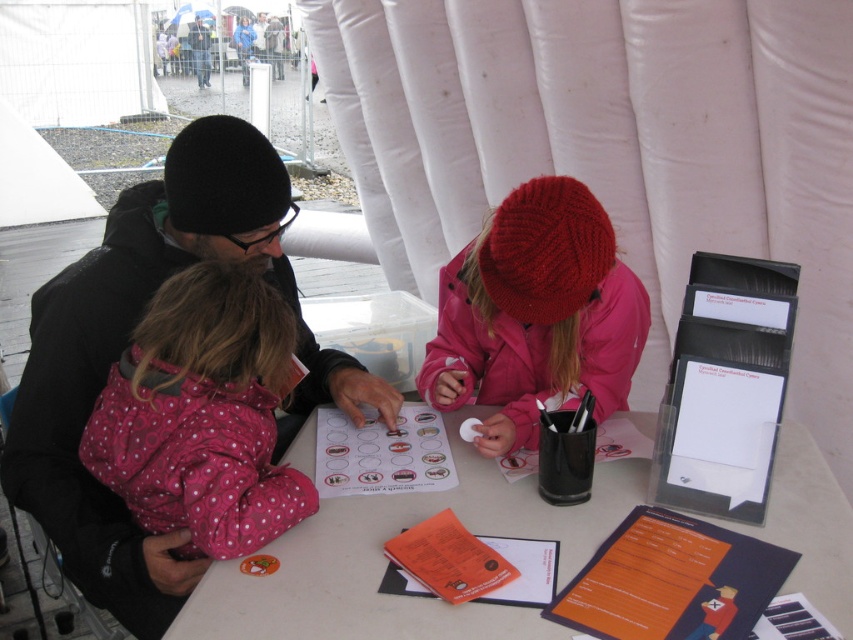
You are standing near the table in the tent. You need to hand a form from the purple folder to the person wearing the pink polka dot jacket at left. Can you reach them directly without moving around the table?

The pink polka dot jacket at left is 3.59 feet away from viewer, so yes, you can reach them directly without moving around the table since the distance is manageable.

You are a volunteer at an event and need to place a new sticker on the white paper at center. However, there is a knitted woolen hat at center in the way. Can you move the hat to the right to make space for the sticker?

The white paper at center is positioned on the left side of the knitted woolen hat at center, so moving the hat to the right would allow access to the paper.

Based on the scene description, where is the black knit hat at upper left located in terms of its 2D coordinates?

The black knit hat at upper left is located at the 2D coordinates point (126, 344).